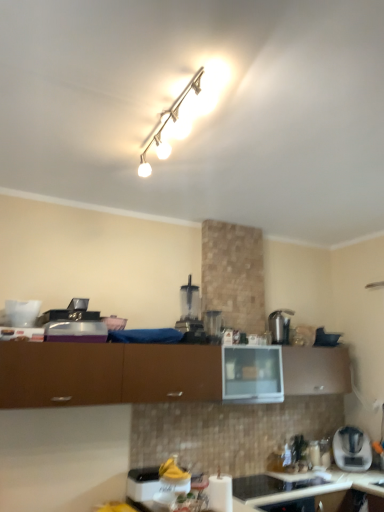
Question: Does clear plastic blender at center, acting as the first appliance starting from the top, lie behind brown matte cabinet at center?

Choices:
 (A) yes
 (B) no

Answer: (A)

Question: From a real-world perspective, is clear plastic blender at center, which appears as the 2th appliance when viewed from the back, positioned under brown matte cabinet at center based on gravity?

Choices:
 (A) no
 (B) yes

Answer: (A)

Question: From a real-world perspective, is clear plastic blender at center, positioned as the fourth appliance in bottom-to-top order, over brown matte cabinet at center?

Choices:
 (A) no
 (B) yes

Answer: (B)

Question: Is the position of clear plastic blender at center, positioned as the 3th appliance in front-to-back order, less distant than that of brown matte cabinet at center?

Choices:
 (A) no
 (B) yes

Answer: (A)

Question: Is clear plastic blender at center, acting as the first appliance starting from the top, far from brown matte cabinet at center?

Choices:
 (A) no
 (B) yes

Answer: (A)

Question: Considering the positions of white paper towel holder at lower center, which is the fourth appliance in back-to-front order, and white glossy paper towel holder at lower center, the 4th appliance when ordered from top to bottom, in the image, is white paper towel holder at lower center, which is the fourth appliance in back-to-front order, wider or thinner than white glossy paper towel holder at lower center, the 4th appliance when ordered from top to bottom,?

Choices:
 (A) wide
 (B) thin

Answer: (B)

Question: From the image's perspective, is white paper towel holder at lower center, the second appliance from the bottom, positioned above or below white glossy paper towel holder at lower center, the 4th appliance when ordered from top to bottom?

Choices:
 (A) below
 (B) above

Answer: (B)

Question: Considering the positions of point (218, 477) and point (248, 479), is point (218, 477) closer or farther from the camera than point (248, 479)?

Choices:
 (A) farther
 (B) closer

Answer: (B)

Question: In terms of height, does white paper towel holder at lower center, which is the 3th appliance from top to bottom, look taller or shorter compared to white glossy paper towel holder at lower center, the third appliance when ordered from back to front?

Choices:
 (A) short
 (B) tall

Answer: (B)

Question: From a real-world perspective, is white glossy track light at upper center positioned above or below white paper towel holder at lower center, the second appliance from the bottom?

Choices:
 (A) below
 (B) above

Answer: (B)

Question: Considering the positions of white glossy track light at upper center and white paper towel holder at lower center, which is the fourth appliance in back-to-front order, in the image, is white glossy track light at upper center taller or shorter than white paper towel holder at lower center, which is the fourth appliance in back-to-front order,?

Choices:
 (A) tall
 (B) short

Answer: (B)

Question: From the image's perspective, is white glossy track light at upper center above or below white paper towel holder at lower center, positioned as the 1th appliance in front-to-back order?

Choices:
 (A) above
 (B) below

Answer: (A)

Question: In terms of width, does white glossy track light at upper center look wider or thinner when compared to white paper towel holder at lower center, which is the fourth appliance in back-to-front order?

Choices:
 (A) thin
 (B) wide

Answer: (B)

Question: Is clear plastic blender at center, positioned as the fourth appliance in bottom-to-top order, wider or thinner than satin silver kettle at upper right, which is the 2th appliance in top-to-bottom order?

Choices:
 (A) wide
 (B) thin

Answer: (B)

Question: Considering the positions of point click(206, 334) and point click(274, 314), is point click(206, 334) closer or farther from the camera than point click(274, 314)?

Choices:
 (A) farther
 (B) closer

Answer: (B)